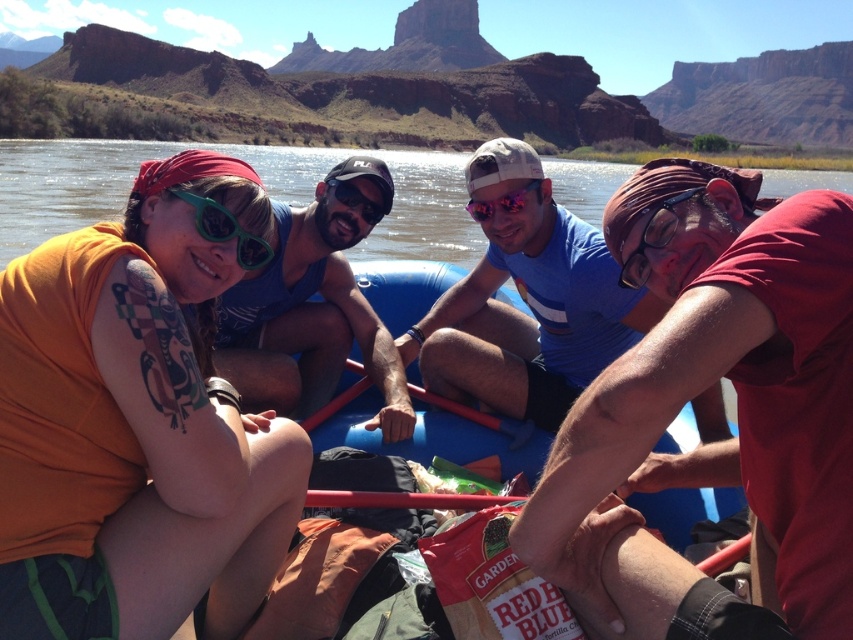
You are a photographer trying to capture a closeup shot of the orange fabric at center and transparent plastic goggles at center. Which object should you focus on first if you want to ensure both are in focus?

The orange fabric at center is positioned under transparent plastic goggles at center, so you should focus on the transparent plastic goggles at center first to ensure both are in focus.

You are a photographer trying to capture a clear shot of the orange fabric at center and the matte black goggles at center from above the raft. Which object will appear smaller in your photo?

The orange fabric at center appears smaller in the photo because it is shorter than the matte black goggles at center.